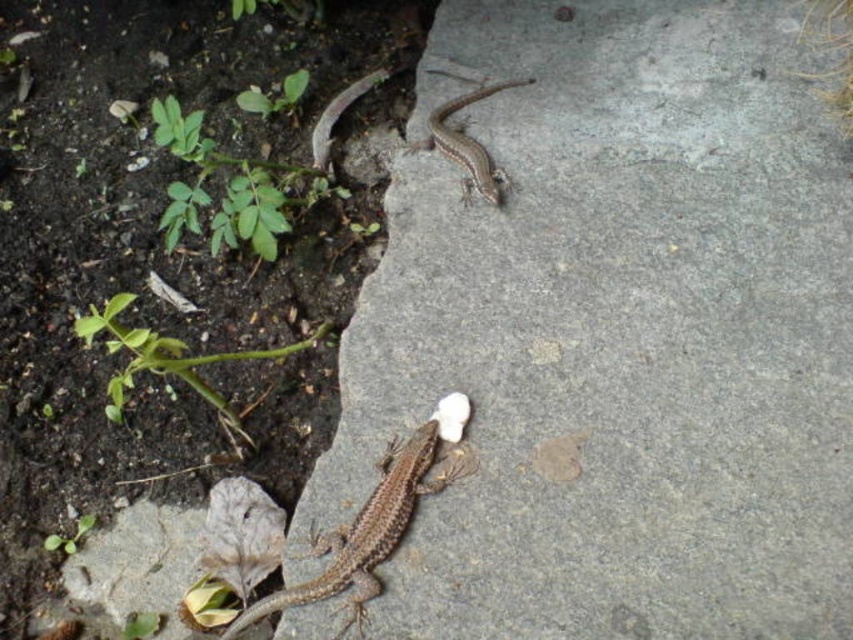
Question: Can you confirm if smooth concrete stone at center is smaller than brown scaly lizard at upper center?

Choices:
 (A) no
 (B) yes

Answer: (A)

Question: Which point is farther to the camera?

Choices:
 (A) brown scaly lizard at upper center
 (B) smooth concrete stone at center
 (C) brown scaly lizard at center

Answer: (A)

Question: Which point is closer to the camera?

Choices:
 (A) (473, 186)
 (B) (339, 589)

Answer: (B)

Question: Considering the real-world distances, which object is closest to the brown scaly lizard at upper center?

Choices:
 (A) smooth concrete stone at center
 (B) brown scaly lizard at center

Answer: (A)

Question: Can you confirm if brown scaly lizard at center is positioned above brown scaly lizard at upper center?

Choices:
 (A) yes
 (B) no

Answer: (B)

Question: Is smooth concrete stone at center in front of brown scaly lizard at center?

Choices:
 (A) no
 (B) yes

Answer: (B)